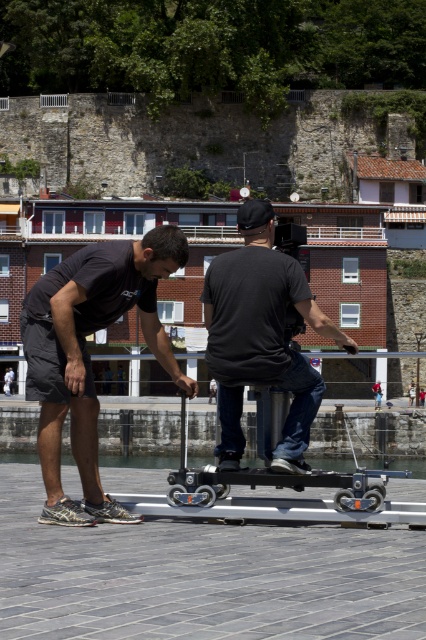
You are a delivery person who needs to quickly move a package from the matte black skateboard at left to the black matte scooter at center. Given their positions, which direction should you move the package to ensure it reaches the correct destination?

The matte black skateboard at left is to the left of the black matte scooter at center, so you should move the package to the right to place it on the black matte scooter at center.

You are standing at the point marked as point (36, 326) in the image. You want to walk straight towards the camera operator. How far will you have to walk to reach them?

The point (36, 326) is 17.78 meters from the viewer, so you will have to walk 17.78 meters to reach the camera operator.

In the scene shown: You are a delivery person who needs to carry both the matte black skateboard at left and the black matte scooter at center. The trunk of your car can only accommodate items that are narrower than 20 inches. Based on the scene, can you fit both items in the trunk without exceeding the width limit?

The matte black skateboard at left might be wider than black matte scooter at center. Since the trunk can only accommodate items narrower than 20 inches, if the skateboard is wider than the scooter but still under 20 inches, both could fit. However, if the skateboard exceeds 20 inches, it won